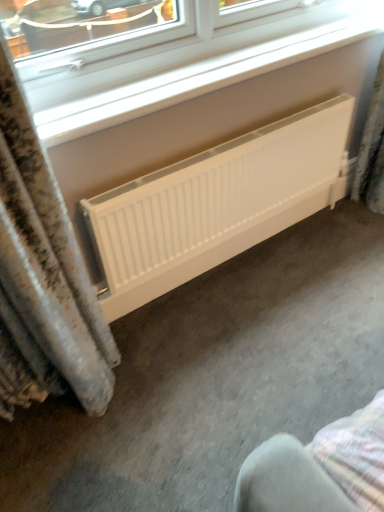
What do you see at coordinates (164, 53) in the screenshot? I see `white plastic window at upper center` at bounding box center [164, 53].

Find the location of a particular element. The image size is (384, 512). white plastic window at upper center is located at coordinates (164, 53).

The width and height of the screenshot is (384, 512). What do you see at coordinates (216, 204) in the screenshot? I see `white matte radiator at center` at bounding box center [216, 204].

You are a GUI agent. You are given a task and a screenshot of the screen. Output one action in this format:
    pyautogui.click(x=<x>, y=<y>)
    Task: Click on the white matte radiator at center
    This screenshot has height=512, width=384.
    Given the screenshot: What is the action you would take?
    pyautogui.click(x=216, y=204)

Identify the location of white plastic window at upper center. (164, 53).

Between white plastic window at upper center and white matte radiator at center, which one appears on the left side from the viewer's perspective?

From the viewer's perspective, white plastic window at upper center appears more on the left side.

Considering their positions, is white plastic window at upper center located in front of or behind white matte radiator at center?

white plastic window at upper center is positioned closer to the viewer than white matte radiator at center.

Does point (298, 42) come closer to viewer compared to point (303, 159)?

Yes.

From the image's perspective, which one is positioned higher, white plastic window at upper center or white matte radiator at center?

From the image's view, white plastic window at upper center is above.

From a real-world perspective, which is physically above, white plastic window at upper center or white matte radiator at center?

white plastic window at upper center is physically above.

Considering the relative sizes of white plastic window at upper center and white matte radiator at center in the image provided, is white plastic window at upper center wider than white matte radiator at center?

Yes, white plastic window at upper center is wider than white matte radiator at center.

Does white plastic window at upper center have a lesser height compared to white matte radiator at center?

Yes, white plastic window at upper center is shorter than white matte radiator at center.

Considering the relative sizes of white plastic window at upper center and white matte radiator at center in the image provided, is white plastic window at upper center bigger than white matte radiator at center?

Incorrect, white plastic window at upper center is not larger than white matte radiator at center.

Is white plastic window at upper center spatially inside white matte radiator at center, or outside of it?

white plastic window at upper center is not enclosed by white matte radiator at center.

Is white plastic window at upper center far from white matte radiator at center?

No.

Is white plastic window at upper center turned away from white matte radiator at center?

white plastic window at upper center does not have its back to white matte radiator at center.

Where is `radiator that appears below the white plastic window at upper center (from the image's perspective)`? radiator that appears below the white plastic window at upper center (from the image's perspective) is located at coordinates (216, 204).

Is white matte radiator at center at the left side of white plastic window at upper center?

In fact, white matte radiator at center is to the right of white plastic window at upper center.

Relative to white plastic window at upper center, is white matte radiator at center in front or behind?

Clearly, white matte radiator at center is behind white plastic window at upper center.

Does point (175, 190) appear closer or farther from the camera than point (136, 76)?

Point (175, 190) appears to be farther away from the viewer than point (136, 76).

From the image's perspective, between white matte radiator at center and white plastic window at upper center, who is located below?

white matte radiator at center, from the image's perspective.

From a real-world perspective, is white matte radiator at center physically below white plastic window at upper center?

Correct, in the physical world, white matte radiator at center is lower than white plastic window at upper center.

Is white matte radiator at center thinner than white plastic window at upper center?

Correct, the width of white matte radiator at center is less than that of white plastic window at upper center.

Can you confirm if white matte radiator at center is shorter than white plastic window at upper center?

In fact, white matte radiator at center may be taller than white plastic window at upper center.

Considering the sizes of objects white matte radiator at center and white plastic window at upper center in the image provided, who is smaller, white matte radiator at center or white plastic window at upper center?

With smaller size is white plastic window at upper center.

Is white plastic window at upper center surrounded by white matte radiator at center?

Actually, white plastic window at upper center is outside white matte radiator at center.

Looking at this image, is white matte radiator at center next to white plastic window at upper center?

white matte radiator at center and white plastic window at upper center are clearly separated.

Is white matte radiator at center oriented towards white plastic window at upper center?

No, white matte radiator at center does not turn towards white plastic window at upper center.

How many degrees apart are the facing directions of white matte radiator at center and white plastic window at upper center?

They differ by 0.893 degrees in their facing directions.

Consider the image. How much distance is there between white matte radiator at center and white plastic window at upper center?

white matte radiator at center and white plastic window at upper center are 16.39 inches apart.

You are a GUI agent. You are given a task and a screenshot of the screen. Output one action in this format:
    pyautogui.click(x=<x>, y=<y>)
    Task: Click on the radiator below the white plastic window at upper center (from the image's perspective)
    This screenshot has height=512, width=384.
    Given the screenshot: What is the action you would take?
    pyautogui.click(x=216, y=204)

Find the location of a particular element. This screenshot has height=512, width=384. window that is above the white matte radiator at center (from the image's perspective) is located at coordinates (164, 53).

Where is `radiator located behind the white plastic window at upper center`? Image resolution: width=384 pixels, height=512 pixels. radiator located behind the white plastic window at upper center is located at coordinates (216, 204).